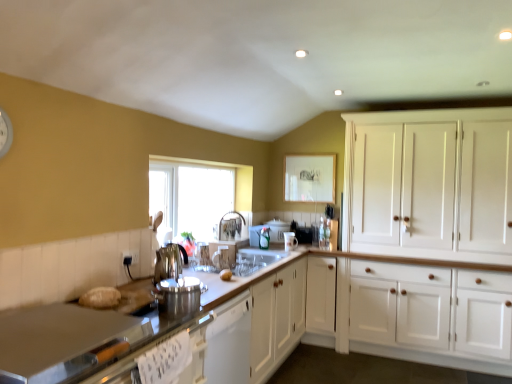
You are a GUI agent. You are given a task and a screenshot of the screen. Output one action in this format:
    pyautogui.click(x=<x>, y=<y>)
    Task: Click on the vacant space in front of bread matte at center
    
    Given the screenshot: What is the action you would take?
    pyautogui.click(x=217, y=279)